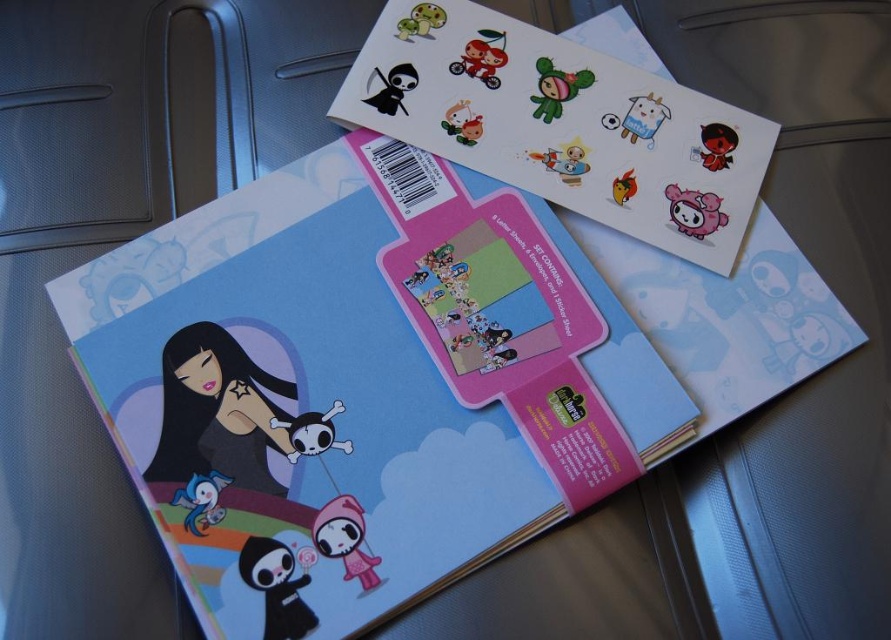
In the scene shown: You need to place a stamp on the matte paper envelope at center. Where should you position the stamp relative to the transparent plastic stickers at upper center?

The matte paper envelope at center is located below the transparent plastic stickers at upper center, so you should position the stamp below the transparent plastic stickers at upper center.